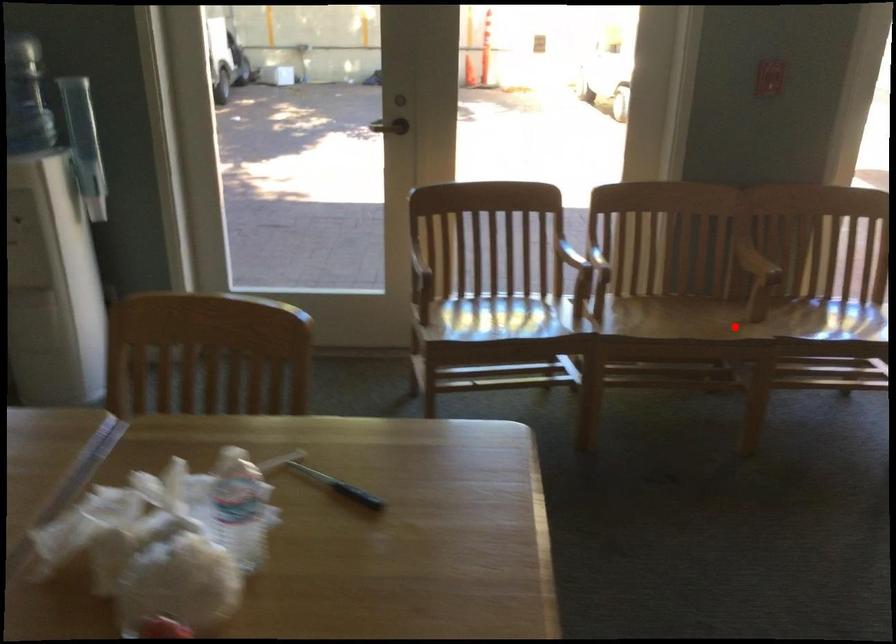
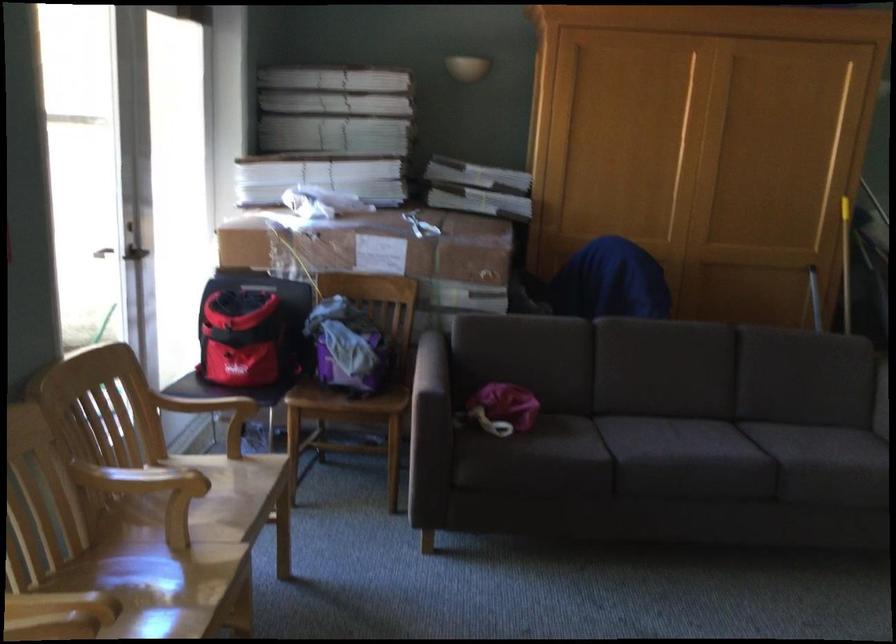
Question: I am providing you with two images of the same scene from different viewpoints. A red point is shown in image1. For the corresponding object point in image2, is it positioned nearer or farther from the camera?

Choices:
 (A) Nearer
 (B) Farther

Answer: (A)